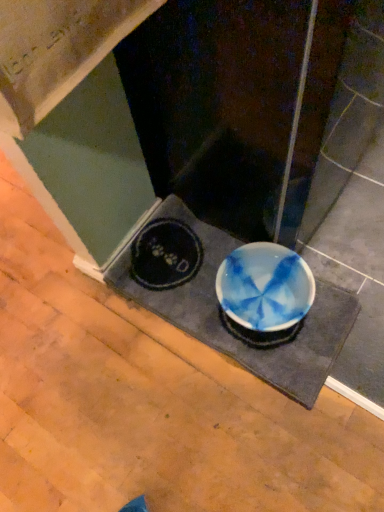
Locate an element on the screen. The height and width of the screenshot is (512, 384). free space on the front side of blue glossy bowl at center is located at coordinates (241, 433).